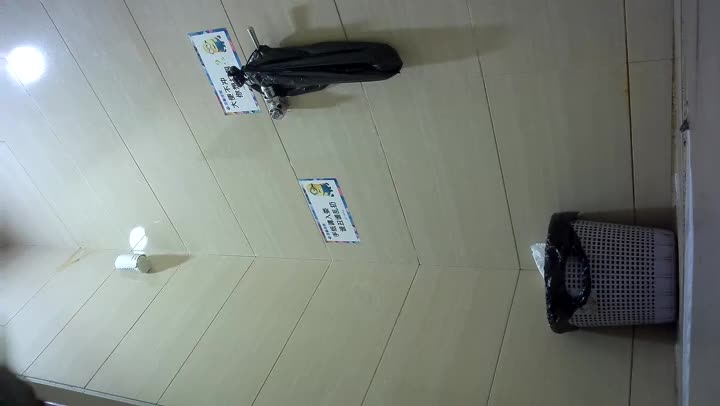
Where is `sticker`? This screenshot has height=406, width=720. sticker is located at coordinates (330, 212), (219, 54).